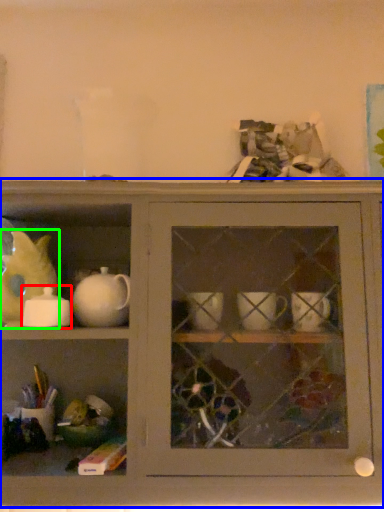
Question: Which object is the closest to the tableware (highlighted by a red box)? Choose among these: shelf (highlighted by a blue box) or animal (highlighted by a green box).

Choices:
 (A) shelf
 (B) animal

Answer: (B)